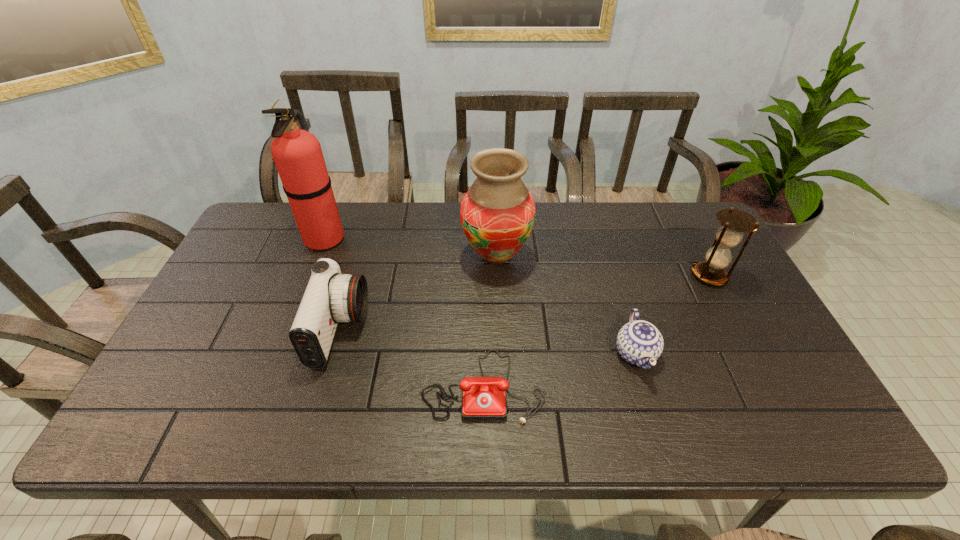
Where is `free space between the fifth object from right to left and the fifth object from left to right`? The height and width of the screenshot is (540, 960). free space between the fifth object from right to left and the fifth object from left to right is located at coordinates (488, 342).

At what (x,y) coordinates should I click in order to perform the action: click on vacant space in between the rightmost object and the fifth object from right to left. Please return your answer as a coordinate pair (x, y). This screenshot has width=960, height=540. Looking at the image, I should click on (525, 303).

Identify the location of empty space that is in between the third shortest object and the second object from right to left. This screenshot has width=960, height=540. (488, 342).

Where is `object that is the fourth closest to the tallest object`? The image size is (960, 540). object that is the fourth closest to the tallest object is located at coordinates (639, 342).

Locate an element on the screen. This screenshot has width=960, height=540. the fourth closest object relative to the fifth shortest object is located at coordinates (297, 154).

Locate an element on the screen. The height and width of the screenshot is (540, 960). free space that satisfies the following two spatial constraints: 1. on the front side of the third tallest object; 2. on the surface of the camcorder is located at coordinates (738, 330).

The height and width of the screenshot is (540, 960). What are the coordinates of `vacant region that satisfies the following two spatial constraints: 1. at the nozzle of the tallest object; 2. on the right side of the rightmost object` in the screenshot? It's located at (310, 275).